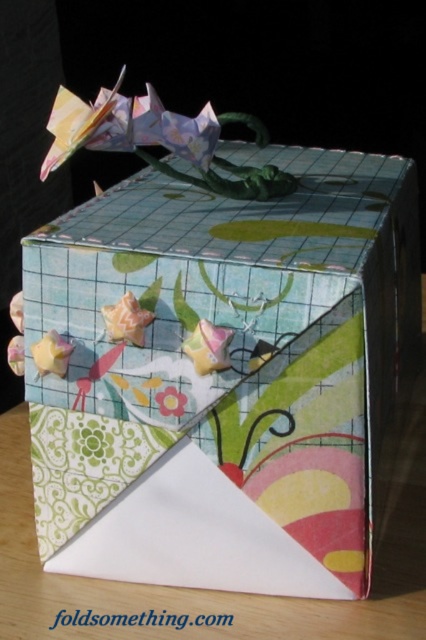
Question: Which of the following is the closest to the observer?

Choices:
 (A) decorative paper box at center
 (B) pastel floral paper flower at center

Answer: (A)

Question: Does decorative paper box at center have a larger size compared to pastel floral paper flower at center?

Choices:
 (A) no
 (B) yes

Answer: (B)

Question: Does decorative paper box at center appear under pastel floral paper flower at center?

Choices:
 (A) yes
 (B) no

Answer: (B)

Question: Can you confirm if decorative paper box at center is positioned below pastel floral paper flower at center?

Choices:
 (A) yes
 (B) no

Answer: (B)